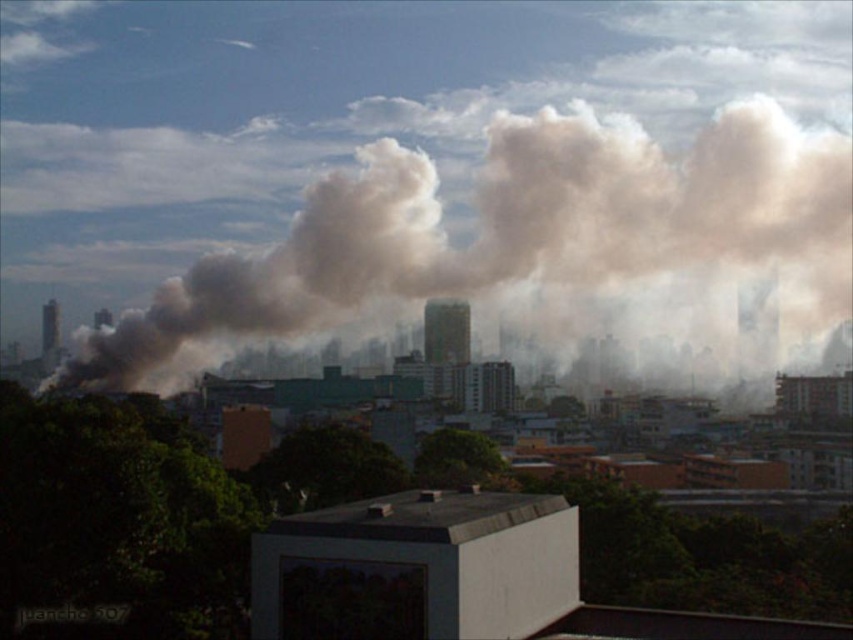
Question: Is gray smoke at center bigger than black glass chimney at left?

Choices:
 (A) no
 (B) yes

Answer: (B)

Question: Which of the following is the closest to the observer?

Choices:
 (A) (57, 332)
 (B) (389, 182)

Answer: (B)

Question: In this image, where is gray smoke at center located relative to black glass chimney at left?

Choices:
 (A) above
 (B) below

Answer: (A)

Question: Can you confirm if gray smoke at center is smaller than black glass chimney at left?

Choices:
 (A) yes
 (B) no

Answer: (B)